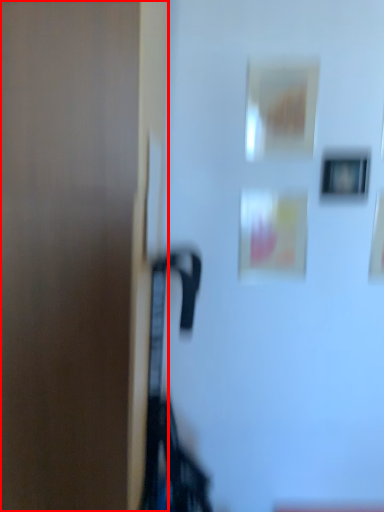
Question: From the image's perspective, what is the correct spatial positioning of door (annotated by the red box) in reference to picture frame?

Choices:
 (A) above
 (B) below

Answer: (B)